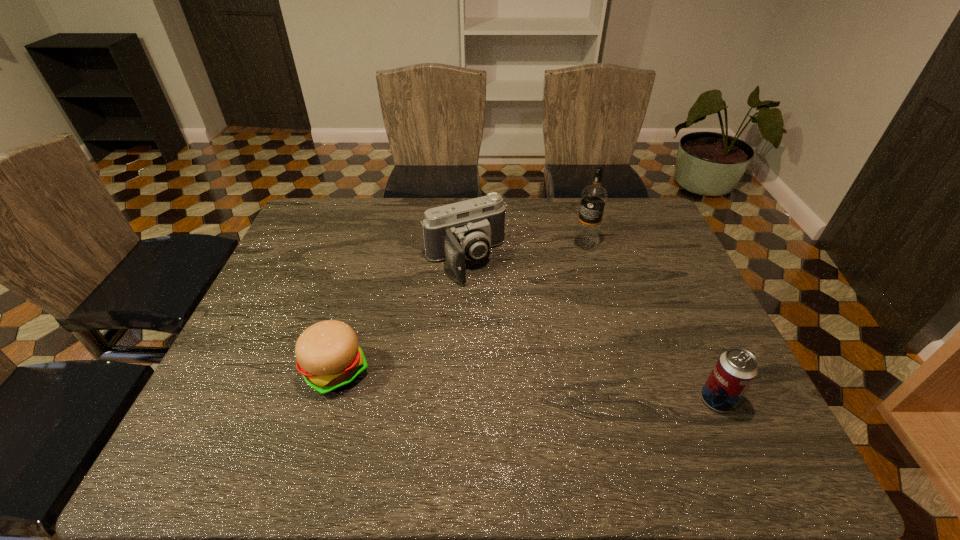
What are the coordinates of `hamburger` in the screenshot? It's located at (329, 357).

This screenshot has height=540, width=960. Identify the location of the shortest object. (329, 357).

Where is `beer can`? beer can is located at coordinates (736, 368).

Locate an element on the screen. The image size is (960, 540). the second object from right to left is located at coordinates (593, 199).

What are the coordinates of `the tallest object` in the screenshot? It's located at click(x=593, y=199).

I want to click on the second object from left to right, so click(468, 229).

The height and width of the screenshot is (540, 960). Find the location of `vacant area situated on the back of the leftmost object`. vacant area situated on the back of the leftmost object is located at coordinates (370, 257).

Image resolution: width=960 pixels, height=540 pixels. Find the location of `vacant region located 0.180m on the back of the rightmost object`. vacant region located 0.180m on the back of the rightmost object is located at coordinates pos(684,327).

Locate an element on the screen. The height and width of the screenshot is (540, 960). vacant space located on the label of the vodka is located at coordinates (563, 271).

In order to click on free space located 0.200m on the label of the vodka in this screenshot , I will do `click(549, 286)`.